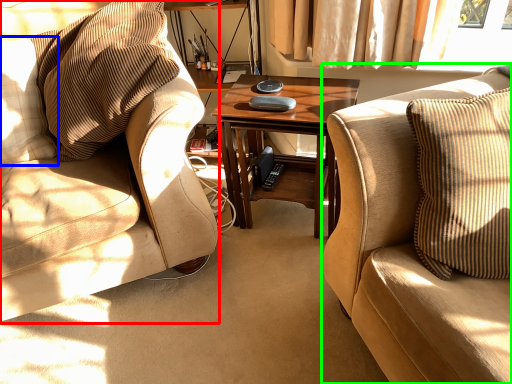
Question: Which is nearer to the chair (highlighted by a red box)? pillow (highlighted by a blue box) or studio couch (highlighted by a green box).

Choices:
 (A) pillow
 (B) studio couch

Answer: (A)